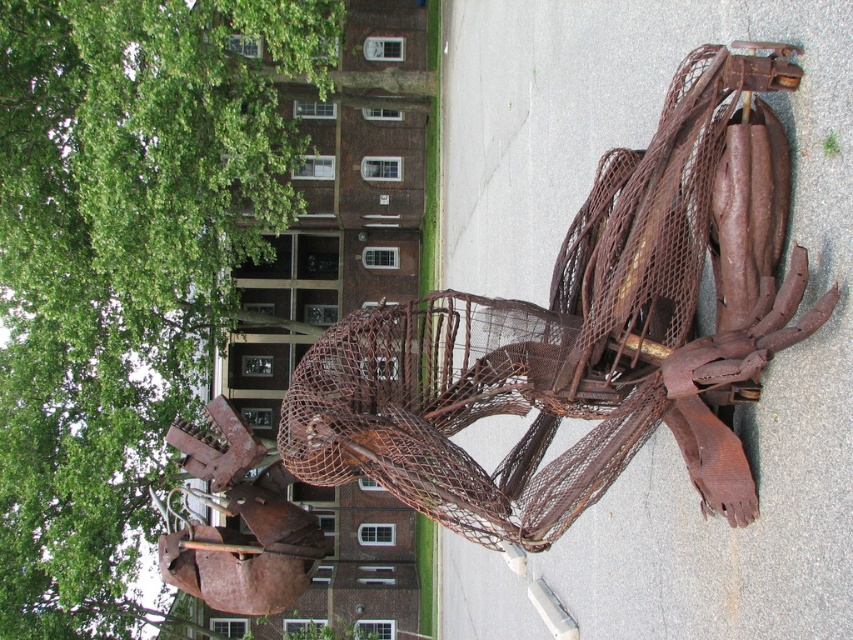
You are standing in front of the sculpture and want to take a photo of both the green leafy tree at upper left and the rusty wire mesh sculpture at center. Which object should you adjust your camera angle to include first?

The green leafy tree at upper left is located above the rusty wire mesh sculpture at center, so you should adjust your camera angle to include the green leafy tree at upper left first by pointing the camera upwards.

You are standing in the outdoor area and want to take a photo of the rusty wire mesh sculpture at center without the green leafy tree at upper left appearing in the frame. Is it possible to do so given their sizes?

The green leafy tree at upper left is much taller than the rusty wire mesh sculpture at center, so it might block the view. However, since the tree is at the upper left and the sculpture is at the center, you can lower your camera angle or move to a position where the tree is out of the frame.